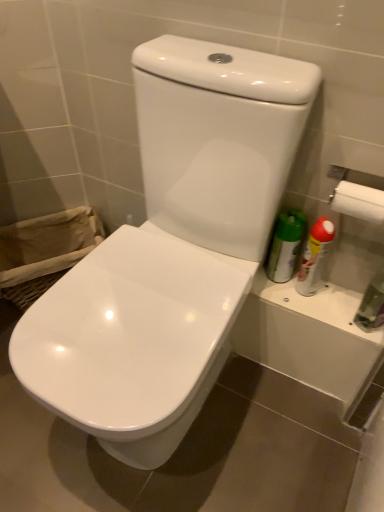
Question: Can we say burlap laundry basket at lower left lies outside white plastic spray can at right?

Choices:
 (A) yes
 (B) no

Answer: (A)

Question: Could you tell me if burlap laundry basket at lower left is turned towards white plastic spray can at right?

Choices:
 (A) no
 (B) yes

Answer: (A)

Question: Are burlap laundry basket at lower left and white plastic spray can at right located far from each other?

Choices:
 (A) yes
 (B) no

Answer: (B)

Question: Is burlap laundry basket at lower left smaller than white plastic spray can at right?

Choices:
 (A) yes
 (B) no

Answer: (B)

Question: Can you confirm if burlap laundry basket at lower left is thinner than white plastic spray can at right?

Choices:
 (A) no
 (B) yes

Answer: (A)

Question: From a real-world perspective, is burlap laundry basket at lower left physically above white plastic spray can at right?

Choices:
 (A) yes
 (B) no

Answer: (B)

Question: Considering the relative positions of white glossy toilet at center, the 2th toilet viewed from the right, and white plastic spray can at right in the image provided, is white glossy toilet at center, the 2th toilet viewed from the right, behind white plastic spray can at right?

Choices:
 (A) yes
 (B) no

Answer: (B)

Question: Is white glossy toilet at center, the 2th toilet viewed from the right, located outside white plastic spray can at right?

Choices:
 (A) yes
 (B) no

Answer: (A)

Question: Is white glossy toilet at center, acting as the first toilet starting from the left, aimed at white plastic spray can at right?

Choices:
 (A) no
 (B) yes

Answer: (A)

Question: Can white plastic spray can at right be found inside white glossy toilet at center, the 2th toilet viewed from the right?

Choices:
 (A) no
 (B) yes

Answer: (A)

Question: Are white glossy toilet at center, acting as the first toilet starting from the left, and white plastic spray can at right making contact?

Choices:
 (A) yes
 (B) no

Answer: (B)

Question: Does white glossy toilet at center, acting as the first toilet starting from the left, have a lesser height compared to white plastic spray can at right?

Choices:
 (A) no
 (B) yes

Answer: (B)

Question: Does transparent plastic bottle at right come behind burlap laundry basket at lower left?

Choices:
 (A) no
 (B) yes

Answer: (A)